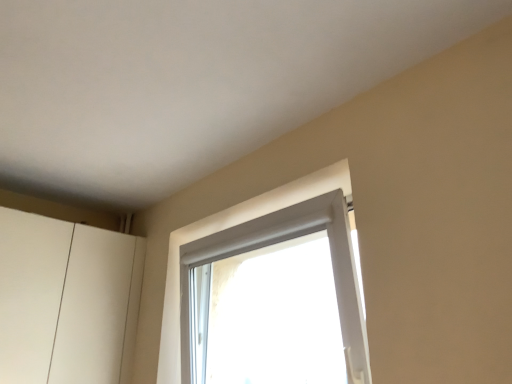
Describe the element at coordinates (279, 242) in the screenshot. I see `white plastic window at upper center` at that location.

The image size is (512, 384). I want to click on white plastic window at upper center, so click(279, 242).

What is the approximate width of white plastic window at upper center?

The width of white plastic window at upper center is 9.13 inches.

Find the location of `white plastic window at upper center`. white plastic window at upper center is located at coordinates (279, 242).